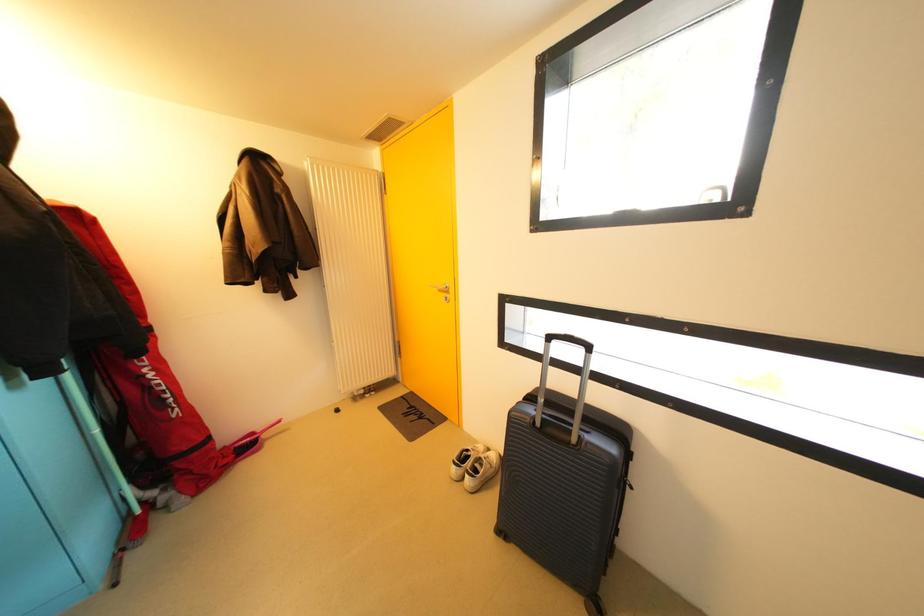
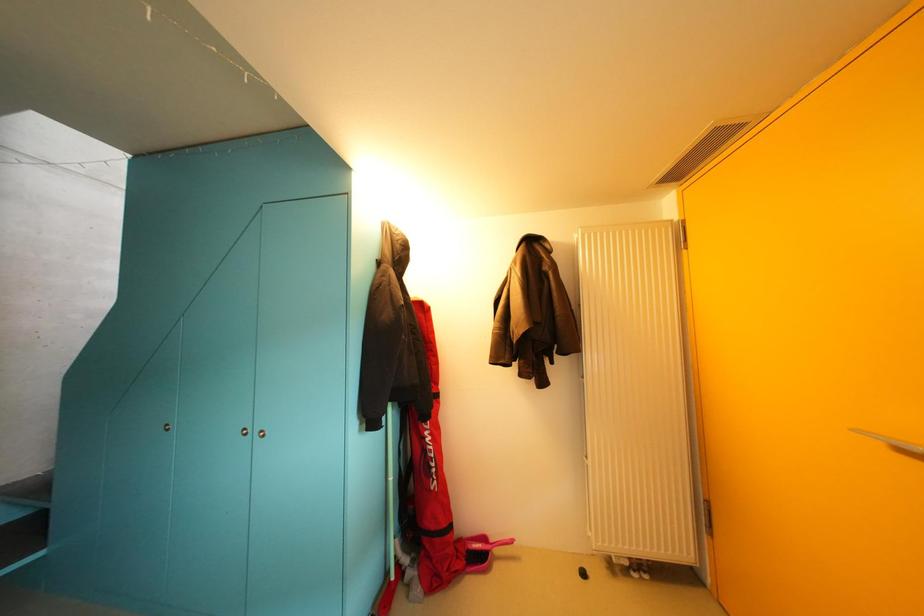
Question: Based on the continuous images, in which direction is the camera rotating? Reply with the corresponding letter.

Choices:
 (A) Left
 (B) Right
 (C) Up
 (D) Down

Answer: (A)